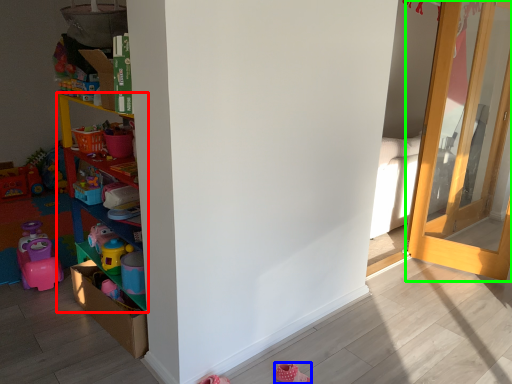
Question: Which is farther away from shelf (highlighted by a red box)? shoe (highlighted by a blue box) or door (highlighted by a green box)?

Choices:
 (A) shoe
 (B) door

Answer: (B)